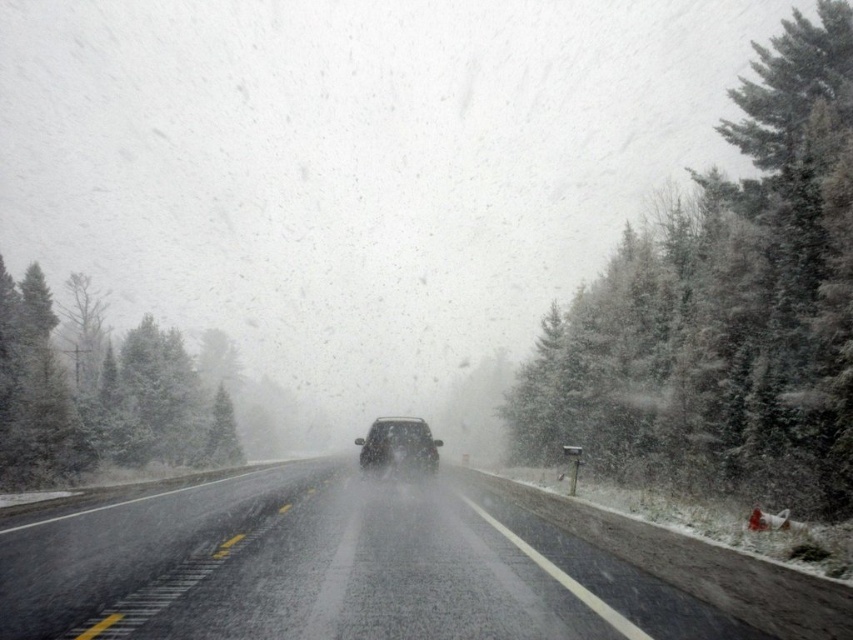
Question: Which is farther from the snow-covered evergreen at right?

Choices:
 (A) glossy asphalt highway at center
 (B) sleek black suv at center

Answer: (B)

Question: Can you confirm if snow-covered evergreen at right is positioned to the right of glossy asphalt highway at center?

Choices:
 (A) no
 (B) yes

Answer: (B)

Question: Based on their relative distances, which object is nearer to the snow-covered evergreen at right?

Choices:
 (A) sleek black suv at center
 (B) glossy asphalt highway at center

Answer: (B)

Question: Which object appears farthest from the camera in this image?

Choices:
 (A) glossy asphalt highway at center
 (B) snow-covered evergreen at right

Answer: (B)

Question: Does glossy asphalt highway at center appear on the right side of sleek black suv at center?

Choices:
 (A) no
 (B) yes

Answer: (A)

Question: Can you confirm if glossy asphalt highway at center is positioned above sleek black suv at center?

Choices:
 (A) yes
 (B) no

Answer: (A)